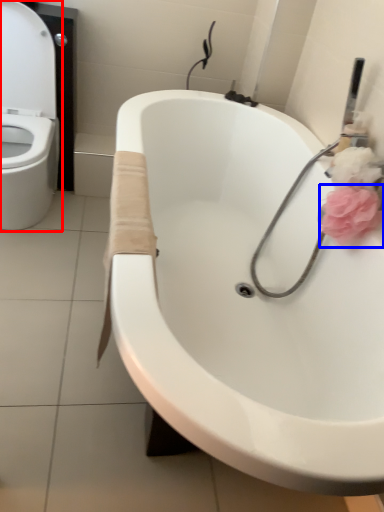
Question: Which object is further to the camera taking this photo, toilet (highlighted by a red box) or flower (highlighted by a blue box)?

Choices:
 (A) toilet
 (B) flower

Answer: (A)